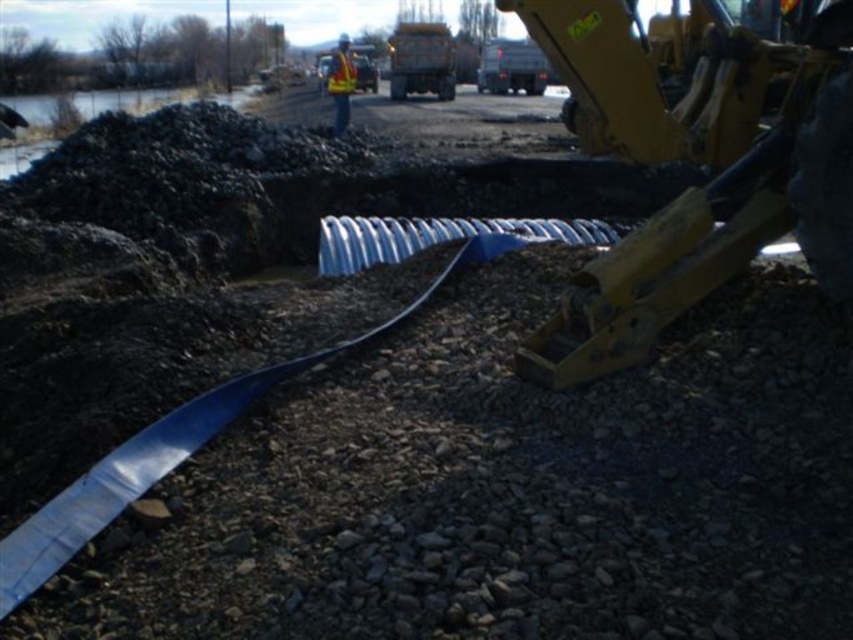
Question: Which is nearer to the yellow reflective vest at center?

Choices:
 (A) gray gravel at center
 (B) yellow metallic excavator at center right

Answer: (B)

Question: Which point is farther to the camera?

Choices:
 (A) gray gravel at center
 (B) yellow reflective vest at center

Answer: (B)

Question: Is gray gravel at center bigger than yellow reflective vest at center?

Choices:
 (A) yes
 (B) no

Answer: (B)

Question: Does yellow metallic excavator at center right appear on the right side of yellow reflective vest at center?

Choices:
 (A) yes
 (B) no

Answer: (A)

Question: Which object appears closest to the camera in this image?

Choices:
 (A) yellow metallic excavator at center right
 (B) yellow reflective vest at center
 (C) gray gravel at center

Answer: (C)

Question: Is gray gravel at center above yellow reflective vest at center?

Choices:
 (A) no
 (B) yes

Answer: (A)